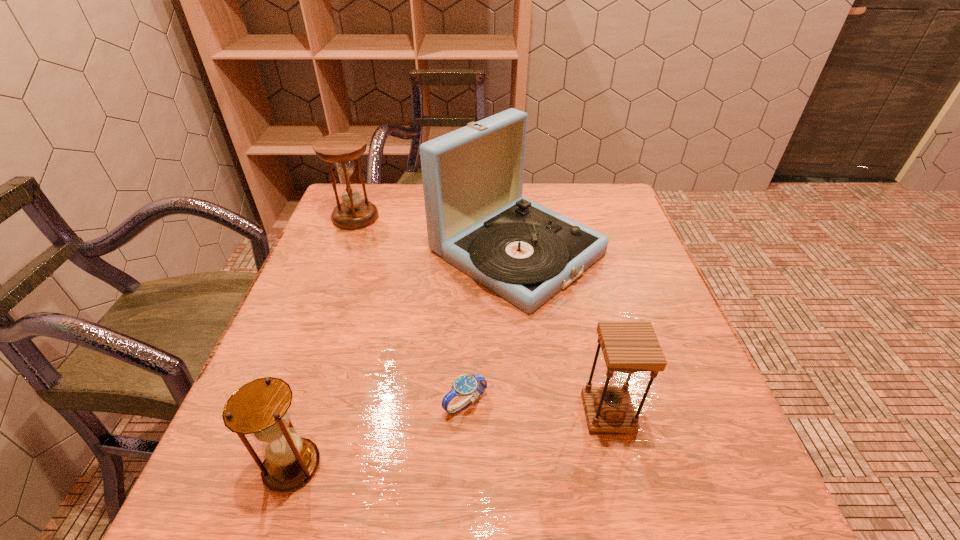
The height and width of the screenshot is (540, 960). Find the location of `vacant space at the left edge`. vacant space at the left edge is located at coordinates (367, 291).

The image size is (960, 540). What are the coordinates of `free space at the right edge of the desktop` in the screenshot? It's located at (632, 240).

Where is `free region at the far left corner of the desktop`? free region at the far left corner of the desktop is located at coordinates (377, 220).

The width and height of the screenshot is (960, 540). In the image, there is a desktop. Find the location of `vacant space at the far right corner`. vacant space at the far right corner is located at coordinates (585, 190).

Where is `vacant space at the near right corner`? This screenshot has width=960, height=540. vacant space at the near right corner is located at coordinates (727, 504).

Find the location of a particular element. free space between the second nearest hourglass and the farthest hourglass is located at coordinates (482, 315).

Identify the location of unoccupied area between the phonograph record and the shortest object. The width and height of the screenshot is (960, 540). (492, 327).

Image resolution: width=960 pixels, height=540 pixels. I want to click on vacant space in between the watch and the phonograph record, so click(492, 327).

This screenshot has height=540, width=960. In order to click on free point between the farthest hourglass and the shortest object in this screenshot , I will do `click(411, 310)`.

Find the location of a particular element. This screenshot has width=960, height=540. free space between the nearest object and the farthest hourglass is located at coordinates (324, 341).